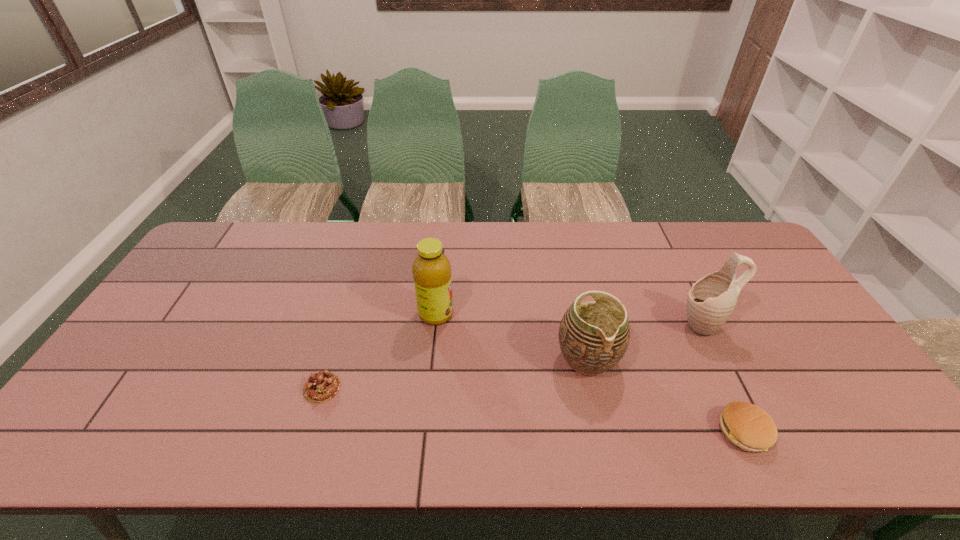
Find the location of a particular element. blank space located at the spout of the pitcher is located at coordinates [633, 325].

The image size is (960, 540). Identify the location of vacant space located 0.100m at the spout of the pitcher. (643, 325).

The width and height of the screenshot is (960, 540). In order to click on vacant area located on the right of the third object from left to right in this screenshot , I will do `click(664, 359)`.

Identify the location of free space located on the right of the nearest object. (804, 431).

Locate an element on the screen. The width and height of the screenshot is (960, 540). vacant space located 0.150m on the back of the leftmost object is located at coordinates (341, 328).

Find the location of `object present at the near edge`. object present at the near edge is located at coordinates (749, 427).

The image size is (960, 540). In order to click on free space at the far edge of the desktop in this screenshot , I will do `click(681, 263)`.

Where is `free space at the near edge of the desktop`? free space at the near edge of the desktop is located at coordinates (800, 441).

You are a GUI agent. You are given a task and a screenshot of the screen. Output one action in this format:
    pyautogui.click(x=<x>, y=<y>)
    Task: Click on the vacant space at the left edge of the desktop
    
    Given the screenshot: What is the action you would take?
    pyautogui.click(x=189, y=314)

Find the location of a particular element. Image resolution: width=960 pixels, height=540 pixels. free location at the right edge of the desktop is located at coordinates (755, 282).